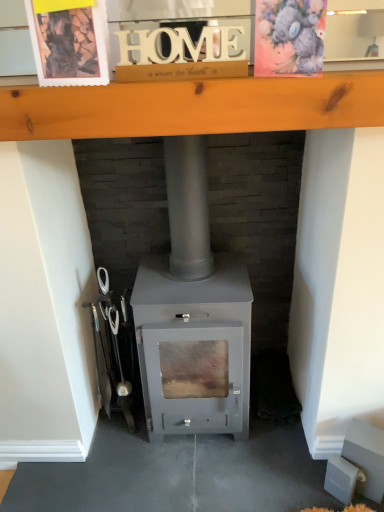
Find the location of `vacant area situated below wooden at upper center (from a real-world perspective)`. vacant area situated below wooden at upper center (from a real-world perspective) is located at coordinates (204, 461).